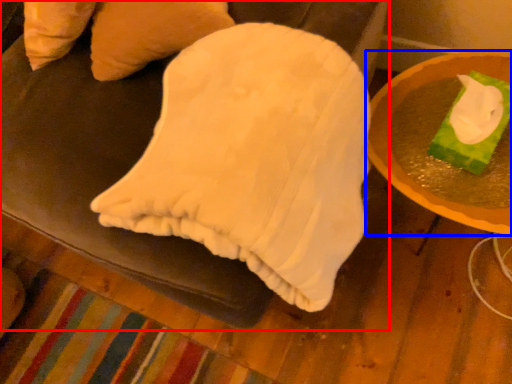
Question: Which point is closer to the camera, furniture (highlighted by a red box) or table (highlighted by a blue box)?

Choices:
 (A) furniture
 (B) table

Answer: (A)